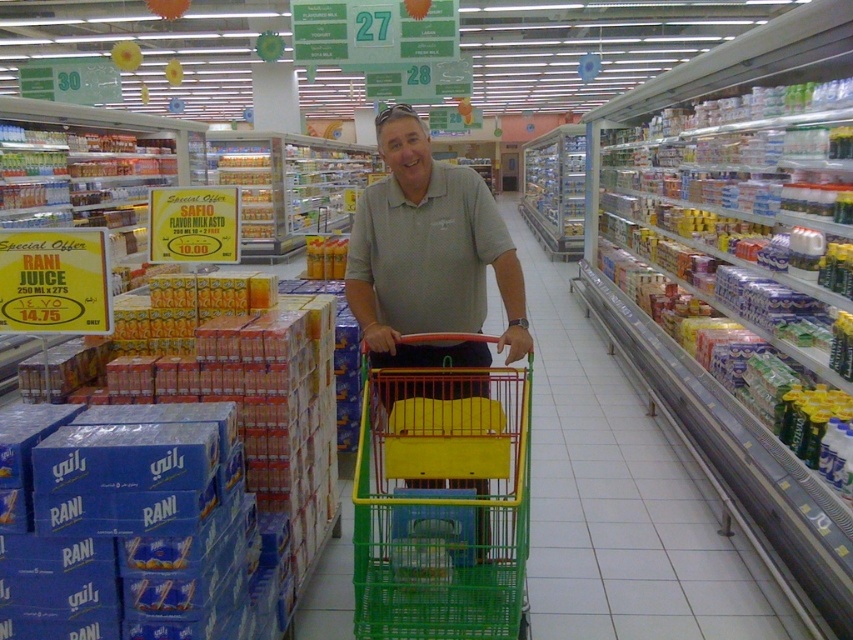
Can you confirm if green plastic trolley at center is positioned below matte gray shirt at center?

Indeed, green plastic trolley at center is positioned under matte gray shirt at center.

This screenshot has width=853, height=640. What do you see at coordinates (442, 500) in the screenshot?
I see `green plastic trolley at center` at bounding box center [442, 500].

What do you see at coordinates (442, 500) in the screenshot? The height and width of the screenshot is (640, 853). I see `green plastic trolley at center` at bounding box center [442, 500].

What are the coordinates of `green plastic trolley at center` in the screenshot? It's located at (442, 500).